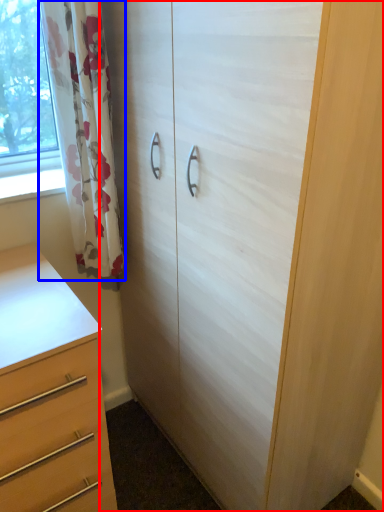
Question: Which object appears closest to the camera in this image, cupboard (highlighted by a red box) or curtain (highlighted by a blue box)?

Choices:
 (A) cupboard
 (B) curtain

Answer: (A)